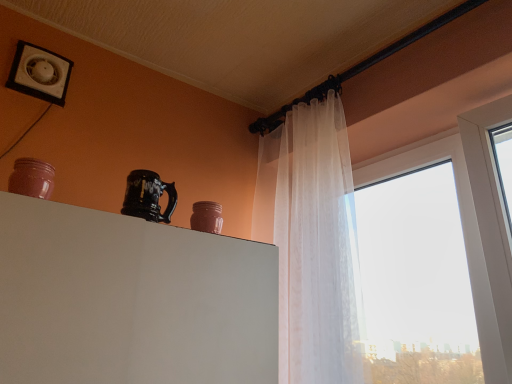
Question: Considering the positions of glossy ceramic mug at upper center and matte pink jar at left, which is the 2th pottery in bottom-to-top order, in the image, is glossy ceramic mug at upper center wider or thinner than matte pink jar at left, which is the 2th pottery in bottom-to-top order,?

Choices:
 (A) wide
 (B) thin

Answer: (A)

Question: Considering the relative positions of glossy ceramic mug at upper center and matte pink jar at left, positioned as the second pottery in right-to-left order, in the image provided, is glossy ceramic mug at upper center to the left or to the right of matte pink jar at left, positioned as the second pottery in right-to-left order,?

Choices:
 (A) left
 (B) right

Answer: (B)

Question: Which object is the farthest from the matte pink jar at left, which ranks as the second pottery in back-to-front order?

Choices:
 (A) white plastic vent at upper left
 (B) glossy ceramic mug at upper center
 (C) matte pink jar at upper center, which is the 2th pottery in left-to-right order

Answer: (A)

Question: Which is nearer to the glossy ceramic mug at upper center?

Choices:
 (A) white plastic vent at upper left
 (B) matte pink jar at upper center, which is the 2th pottery in left-to-right order
 (C) matte pink jar at left, which is the 1th pottery in front-to-back order

Answer: (B)